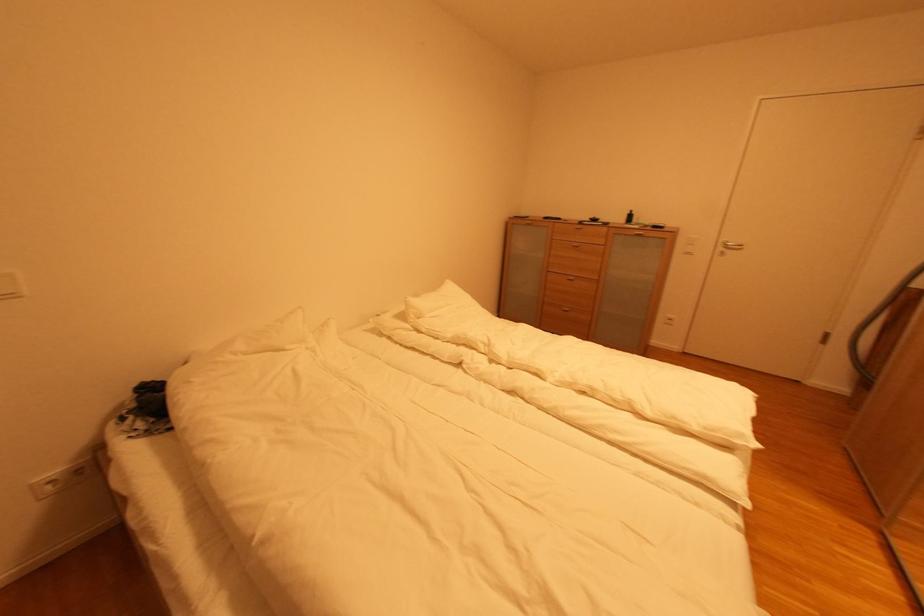
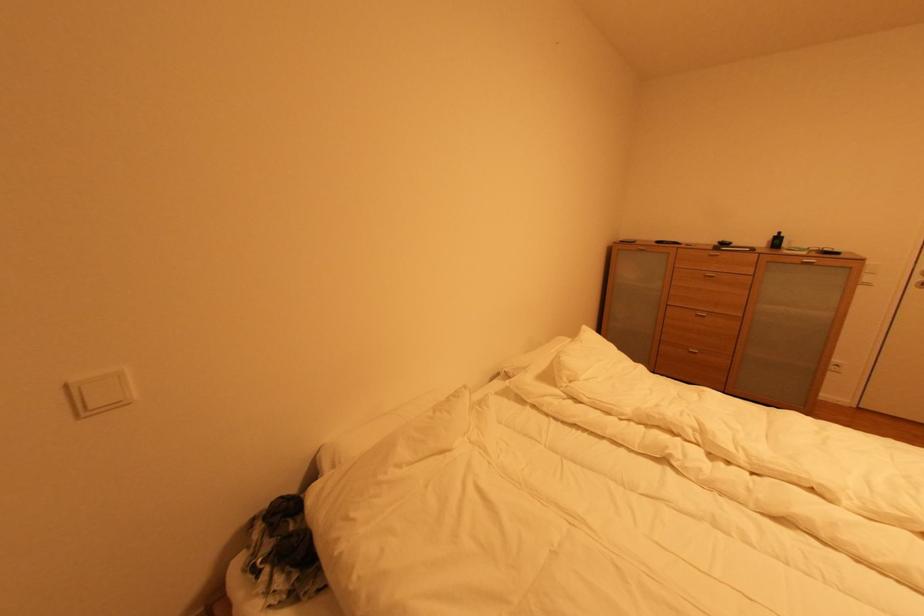
In a continuous first-person perspective shot, in which direction is the camera moving?

The cameraman moved toward left, forward.